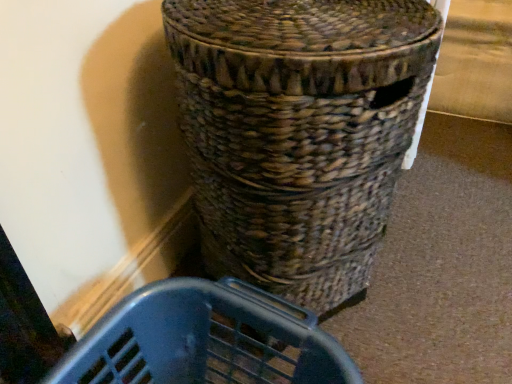
Question: Visually, is blue plastic laundry basket at lower center positioned to the left or to the right of woven brown basket at center?

Choices:
 (A) right
 (B) left

Answer: (B)

Question: Is blue plastic laundry basket at lower center in front of or behind woven brown basket at center in the image?

Choices:
 (A) front
 (B) behind

Answer: (B)

Question: Is blue plastic laundry basket at lower center inside or outside of woven brown basket at center?

Choices:
 (A) outside
 (B) inside

Answer: (A)

Question: Considering the positions of point (280, 137) and point (83, 365), is point (280, 137) closer or farther from the camera than point (83, 365)?

Choices:
 (A) farther
 (B) closer

Answer: (B)

Question: Considering the positions of woven brown basket at center and blue plastic laundry basket at lower center in the image, is woven brown basket at center wider or thinner than blue plastic laundry basket at lower center?

Choices:
 (A) wide
 (B) thin

Answer: (A)

Question: From a real-world perspective, is woven brown basket at center positioned above or below blue plastic laundry basket at lower center?

Choices:
 (A) below
 (B) above

Answer: (B)

Question: Relative to blue plastic laundry basket at lower center, is woven brown basket at center in front or behind?

Choices:
 (A) behind
 (B) front

Answer: (B)